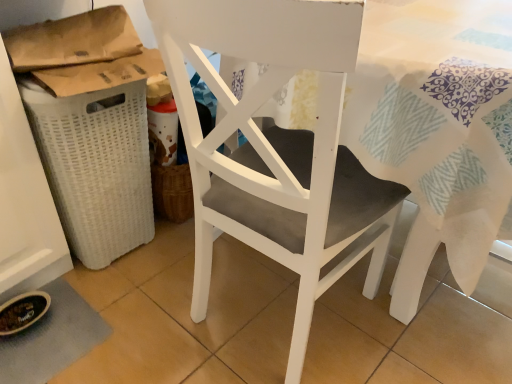
Question: Is point (124, 84) positioned closer to the camera than point (344, 153)?

Choices:
 (A) closer
 (B) farther

Answer: (B)

Question: In terms of size, does white woven laundry basket at left appear bigger or smaller than white matte chair at center?

Choices:
 (A) big
 (B) small

Answer: (B)

Question: From the image's perspective, is white woven laundry basket at left located above or below white matte chair at center?

Choices:
 (A) below
 (B) above

Answer: (B)

Question: Would you say white matte chair at center is inside or outside white woven laundry basket at left?

Choices:
 (A) outside
 (B) inside

Answer: (A)

Question: Is white matte chair at center bigger or smaller than white woven laundry basket at left?

Choices:
 (A) big
 (B) small

Answer: (A)

Question: Is point (270, 144) positioned closer to the camera than point (70, 130)?

Choices:
 (A) closer
 (B) farther

Answer: (A)

Question: Looking at their shapes, would you say white matte chair at center is wider or thinner than white woven laundry basket at left?

Choices:
 (A) wide
 (B) thin

Answer: (A)